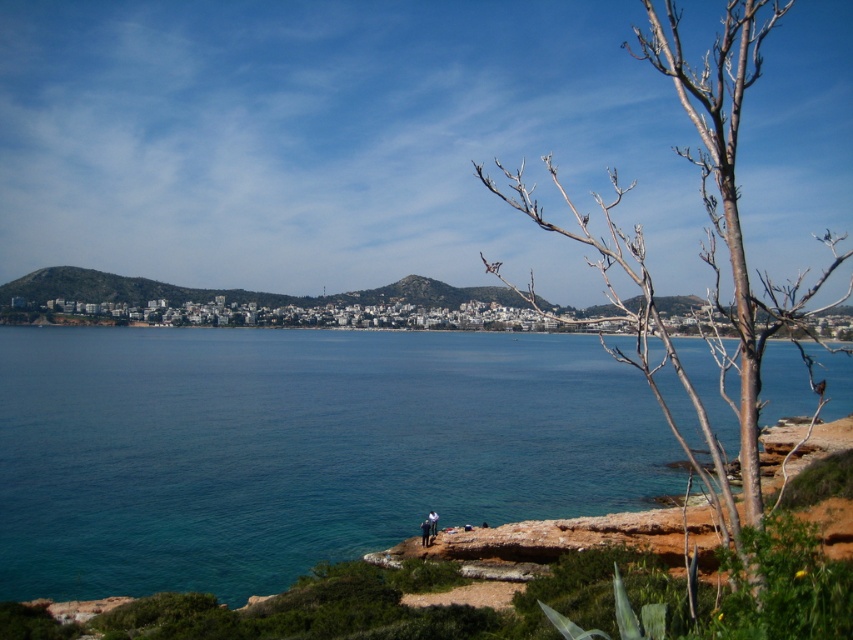
Is blue water at center shorter than dark blue jeans at lower center?

No, blue water at center is not shorter than dark blue jeans at lower center.

Is blue water at center smaller than dark blue jeans at lower center?

No, blue water at center is not smaller than dark blue jeans at lower center.

Identify the location of blue water at center. (x=296, y=449).

Locate an element on the screen. The width and height of the screenshot is (853, 640). blue water at center is located at coordinates (296, 449).

The width and height of the screenshot is (853, 640). What do you see at coordinates (296, 449) in the screenshot?
I see `blue water at center` at bounding box center [296, 449].

Can you confirm if blue water at center is positioned above white cotton shirt at lower center?

Yes, blue water at center is above white cotton shirt at lower center.

Where is `blue water at center`? blue water at center is located at coordinates (296, 449).

Locate an element on the screen. This screenshot has width=853, height=640. blue water at center is located at coordinates (296, 449).

Who is lower down, bare wood tree at right or white cotton shirt at lower center?

Positioned lower is white cotton shirt at lower center.

Does point (773, 1) lie behind point (428, 522)?

Yes, it is behind point (428, 522).

I want to click on bare wood tree at right, so click(x=706, y=237).